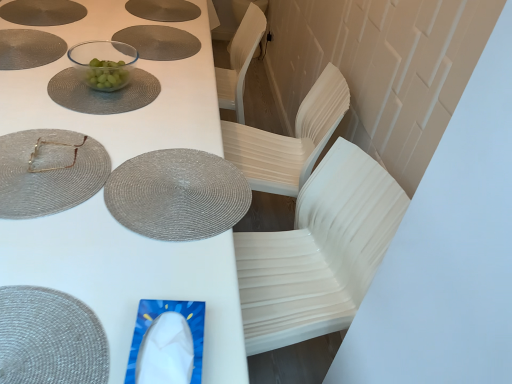
You are a GUI agent. You are given a task and a screenshot of the screen. Output one action in this format:
    pyautogui.click(x=<x>, y=<y>)
    Task: Click on the free space between silver textured placemat at center, which is counted as the 2th tableware, starting from the bottom, and clear glass bowl at upper center, placed as the fourth tableware when sorted from bottom to top
    
    Given the screenshot: What is the action you would take?
    pyautogui.click(x=143, y=117)